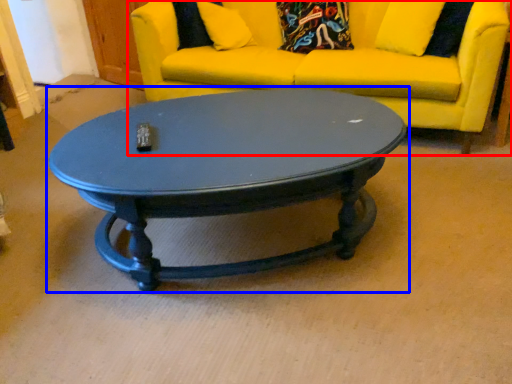
Question: Which of the following is the closest to the observer, studio couch (highlighted by a red box) or coffee table (highlighted by a blue box)?

Choices:
 (A) studio couch
 (B) coffee table

Answer: (B)